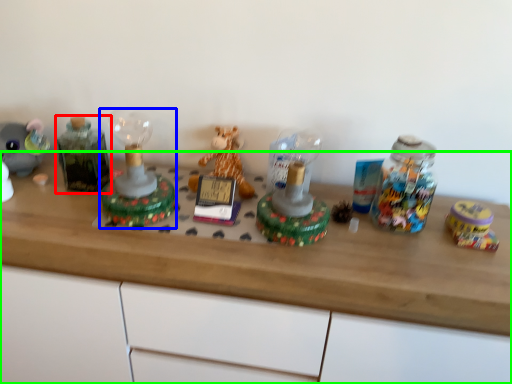
Question: Which object is positioned farthest from bottle (highlighted by a red box)? Select from toy (highlighted by a blue box) and desk (highlighted by a green box).

Choices:
 (A) toy
 (B) desk

Answer: (B)